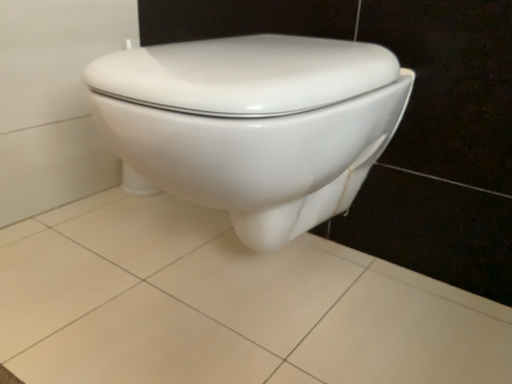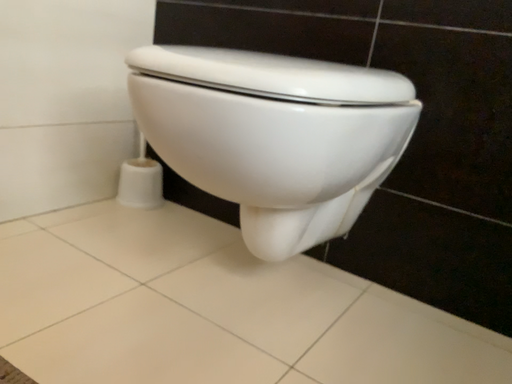
Question: How did the camera likely rotate when shooting the video?

Choices:
 (A) rotated downward
 (B) rotated upward

Answer: (B)